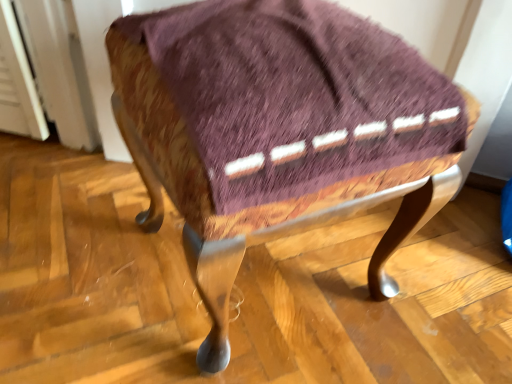
What are the coordinates of `free spot below woven fabric stool at center (from a real-world perspective)` in the screenshot? It's located at (271, 276).